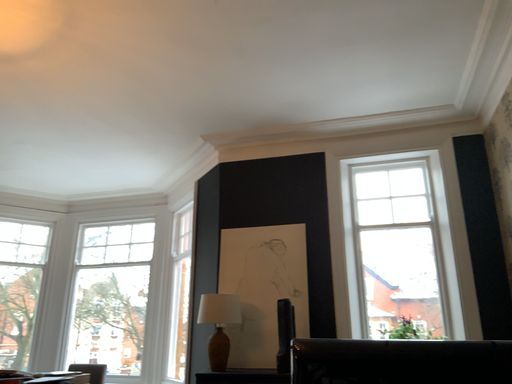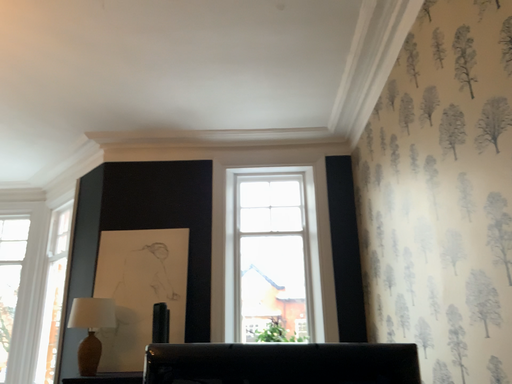
Question: Which way did the camera rotate in the video?

Choices:
 (A) rotated left
 (B) rotated right

Answer: (B)